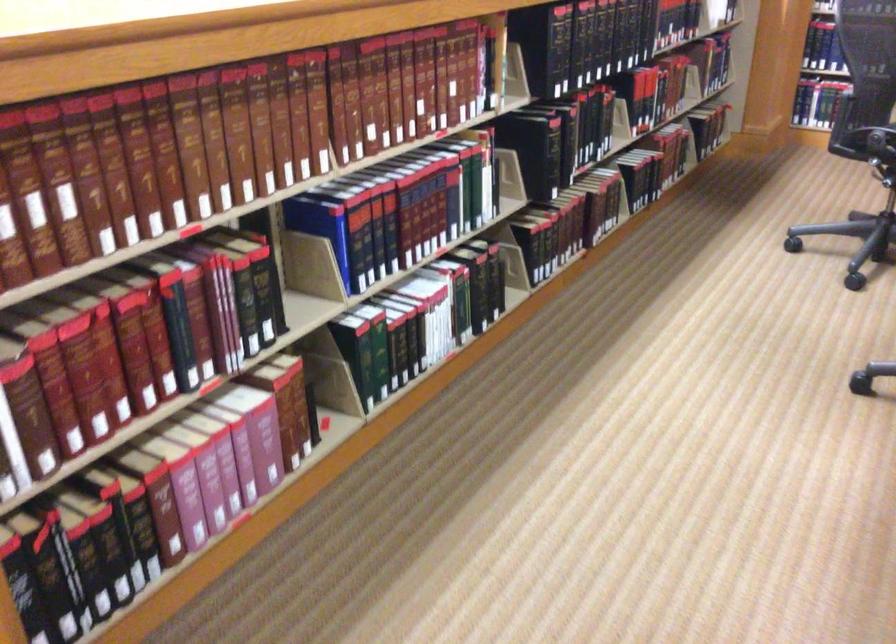
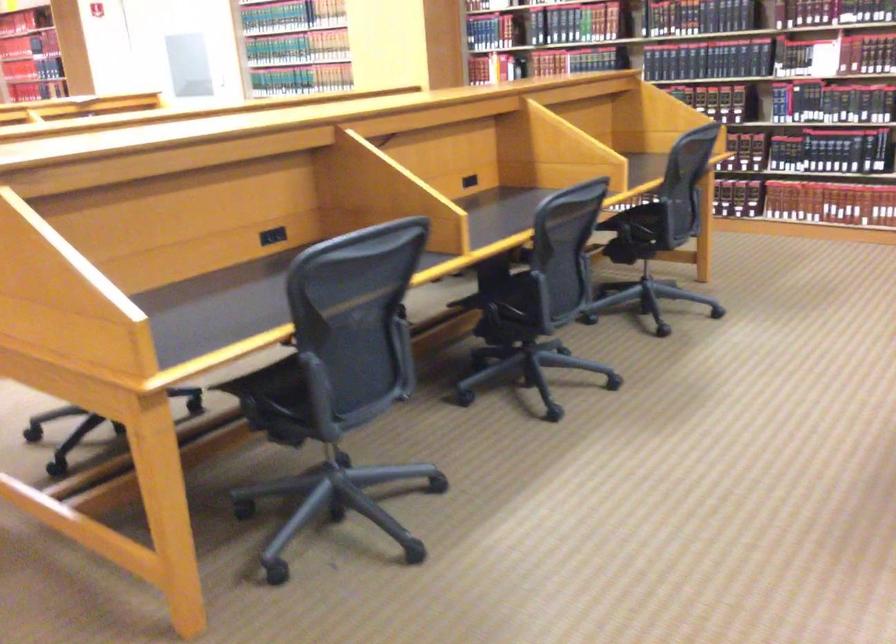
The images are taken continuously from a first-person perspective. In which direction are you moving?

The cameraman walked toward right, backward.